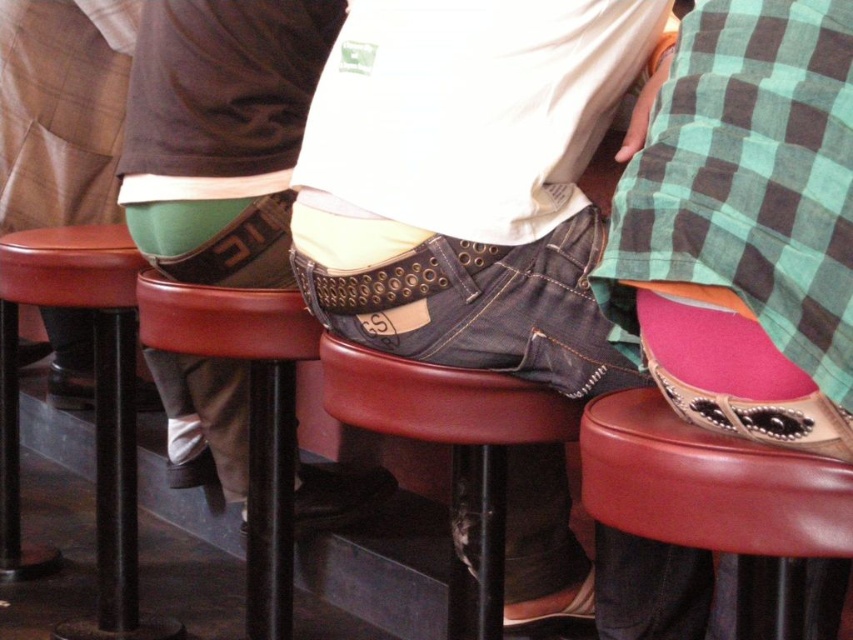
You are a photographer setting up a shoot in this scene. You need to place a small prop between the jeans at center and the leather at center. Which object should the prop be placed closer to, the one that is taller or the one that is shorter?

The jeans at center is taller than leather at center, so the prop should be placed closer to the jeans at center.